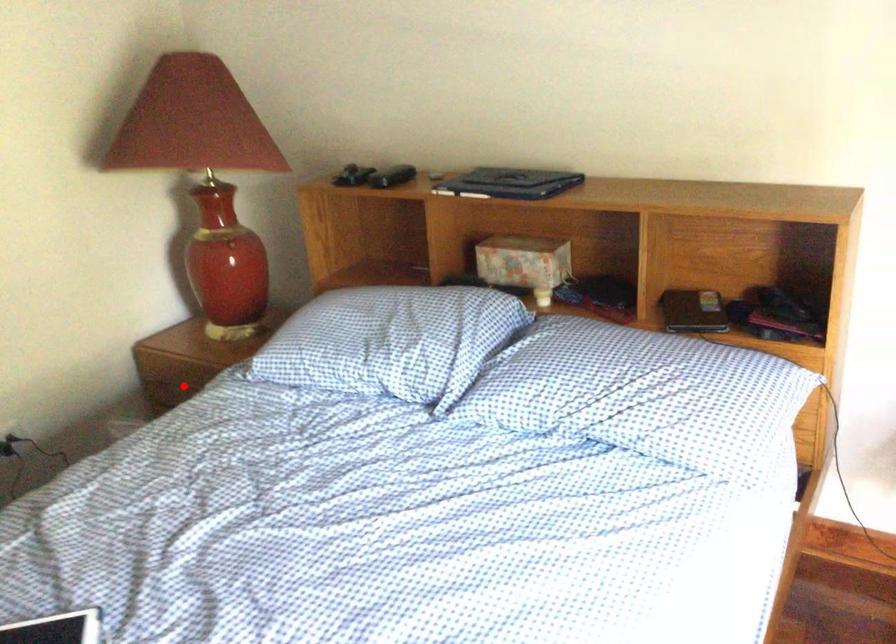
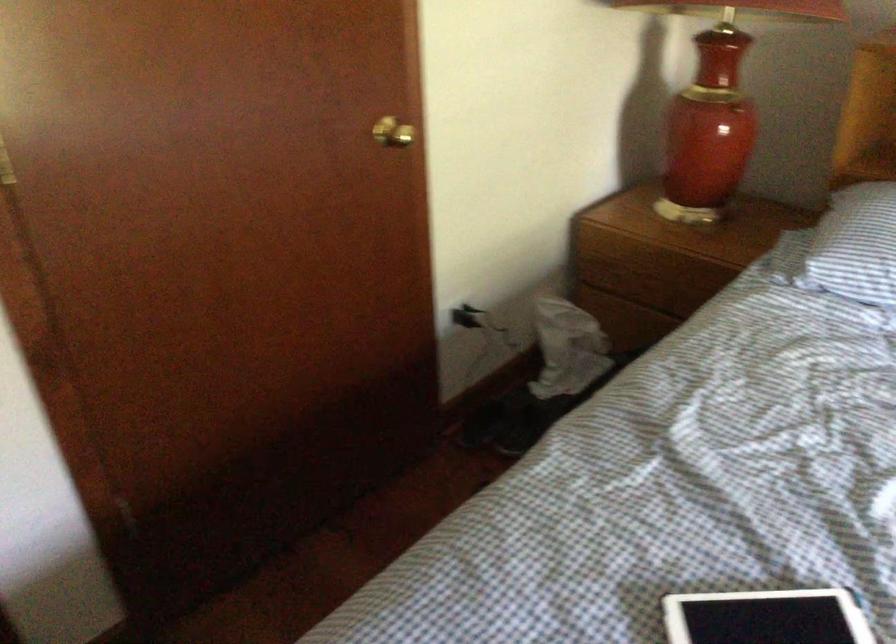
Where in the second image is the point corresponding to the highlighted location from the first image?

(650, 283)